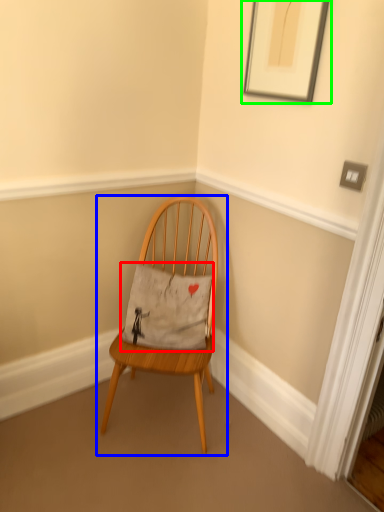
Question: Considering the real-world distances, which object is farthest from pillow (highlighted by a red box)? chair (highlighted by a blue box) or picture frame (highlighted by a green box)?

Choices:
 (A) chair
 (B) picture frame

Answer: (B)